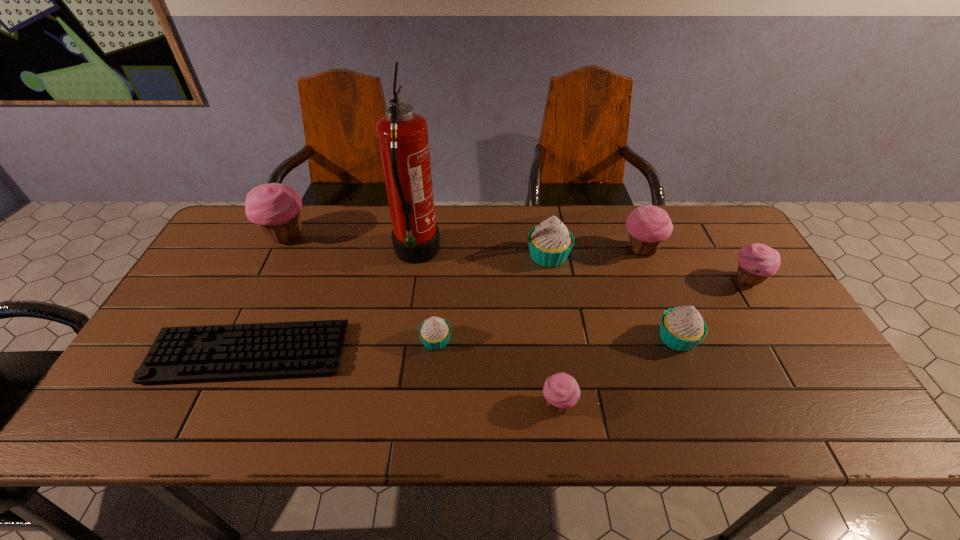
You are a GUI agent. You are given a task and a screenshot of the screen. Output one action in this format:
    pyautogui.click(x=<x>, y=<y>)
    Task: Click on the fire extinguisher
    The height and width of the screenshot is (540, 960).
    Given the screenshot: What is the action you would take?
    pyautogui.click(x=402, y=135)

I want to click on red fire extinguisher, so click(x=402, y=135).

Locate an element on the screen. This screenshot has height=540, width=960. the leftmost pink cupcake is located at coordinates (275, 207).

You are a GUI agent. You are given a task and a screenshot of the screen. Output one action in this format:
    pyautogui.click(x=<x>, y=<y>)
    Task: Click on the biggest pink cupcake
    This screenshot has height=540, width=960.
    Given the screenshot: What is the action you would take?
    pyautogui.click(x=275, y=207)

Where is `the second pink cupcake from right to left`? The image size is (960, 540). the second pink cupcake from right to left is located at coordinates (648, 225).

Locate an element on the screen. Image resolution: width=960 pixels, height=540 pixels. the biggest white cupcake is located at coordinates (550, 243).

The width and height of the screenshot is (960, 540). I want to click on the farthest white cupcake, so 550,243.

Locate an element on the screen. the third farthest pink cupcake is located at coordinates (757, 262).

The height and width of the screenshot is (540, 960). Find the location of `the rightmost pink cupcake`. the rightmost pink cupcake is located at coordinates (757, 262).

You are a GUI agent. You are given a task and a screenshot of the screen. Output one action in this format:
    pyautogui.click(x=<x>, y=<y>)
    Task: Click on the rightmost white cupcake
    
    Given the screenshot: What is the action you would take?
    point(682,328)